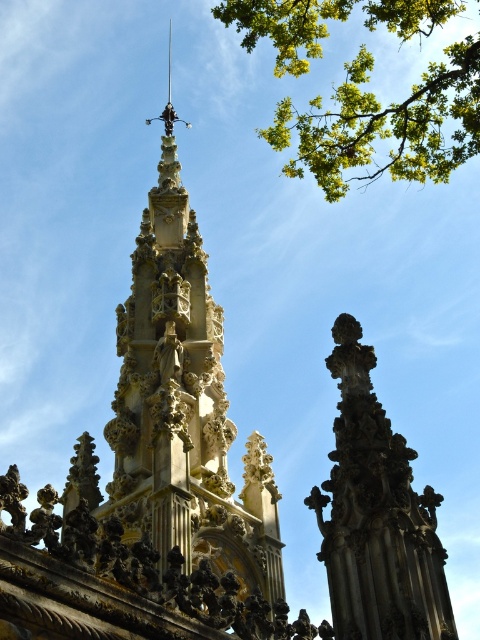
Is golden stone spire at center to the left of carved stone spire at center from the viewer's perspective?

Yes, golden stone spire at center is to the left of carved stone spire at center.

Can you confirm if golden stone spire at center is shorter than carved stone spire at center?

Incorrect, golden stone spire at center's height does not fall short of carved stone spire at center's.

At what (x,y) coordinates should I click in order to perform the action: click on golden stone spire at center. Please return your answer as a coordinate pair (x, y). This screenshot has width=480, height=640. Looking at the image, I should click on (183, 406).

The image size is (480, 640). Find the location of `golden stone spire at center`. golden stone spire at center is located at coordinates (183, 406).

Is golden stone spire at center positioned in front of green leafy branch at upper right?

Yes, golden stone spire at center is closer to the viewer.

Locate an element on the screen. This screenshot has width=480, height=640. golden stone spire at center is located at coordinates (183, 406).

Who is more forward, (192, 406) or (291, 157)?

Positioned in front is point (192, 406).

You are a GUI agent. You are given a task and a screenshot of the screen. Output one action in this format:
    pyautogui.click(x=<x>, y=<y>)
    Task: Click on the golden stone spire at center
    
    Given the screenshot: What is the action you would take?
    pyautogui.click(x=183, y=406)

What do you see at coordinates (385, 124) in the screenshot?
I see `green leafy branch at upper right` at bounding box center [385, 124].

Is green leafy branch at upper right positioned behind carved stone spire at center?

Yes, green leafy branch at upper right is further from the viewer.

Does point (404, 4) come behind point (342, 432)?

That is True.

At what (x,y) coordinates should I click in order to perform the action: click on green leafy branch at upper right. Please return your answer as a coordinate pair (x, y). This screenshot has height=640, width=480. Looking at the image, I should click on (x=385, y=124).